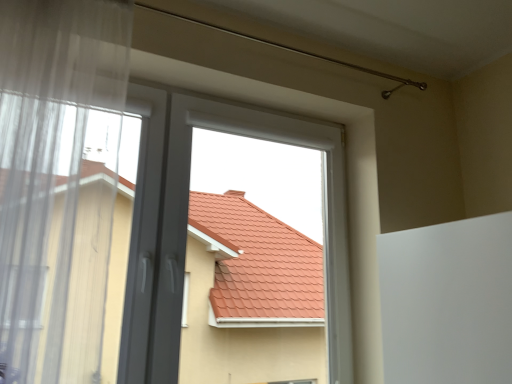
Question: Is white plastic window at center looking in the opposite direction of transparent fabric at left?

Choices:
 (A) no
 (B) yes

Answer: (A)

Question: From the image's perspective, is white plastic window at center above transparent fabric at left?

Choices:
 (A) yes
 (B) no

Answer: (B)

Question: Can you confirm if white plastic window at center is positioned to the right of transparent fabric at left?

Choices:
 (A) yes
 (B) no

Answer: (A)

Question: Can you confirm if white plastic window at center is smaller than transparent fabric at left?

Choices:
 (A) yes
 (B) no

Answer: (B)

Question: Is white plastic window at center at the left side of transparent fabric at left?

Choices:
 (A) yes
 (B) no

Answer: (B)

Question: Is white plastic window at center thinner than transparent fabric at left?

Choices:
 (A) yes
 (B) no

Answer: (A)

Question: Does transparent fabric at left turn towards white plastic window at center?

Choices:
 (A) no
 (B) yes

Answer: (A)

Question: Is transparent fabric at left wider than white plastic window at center?

Choices:
 (A) yes
 (B) no

Answer: (A)

Question: Is transparent fabric at left positioned far away from white plastic window at center?

Choices:
 (A) no
 (B) yes

Answer: (A)

Question: Is transparent fabric at left oriented away from white plastic window at center?

Choices:
 (A) no
 (B) yes

Answer: (A)

Question: Considering the relative sizes of transparent fabric at left and white plastic window at center in the image provided, is transparent fabric at left shorter than white plastic window at center?

Choices:
 (A) no
 (B) yes

Answer: (A)

Question: Is the surface of transparent fabric at left in direct contact with white plastic window at center?

Choices:
 (A) no
 (B) yes

Answer: (A)

Question: In the image, is white plastic window at center positioned in front of or behind transparent fabric at left?

Choices:
 (A) front
 (B) behind

Answer: (B)